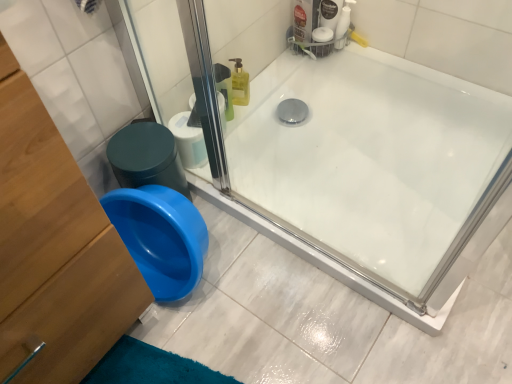
Question: From a real-world perspective, is white matte toilet paper at center physically above white glossy bathtub at center?

Choices:
 (A) no
 (B) yes

Answer: (B)

Question: Could you tell me if white matte toilet paper at center is facing white glossy bathtub at center?

Choices:
 (A) yes
 (B) no

Answer: (A)

Question: Considering the relative positions of white matte toilet paper at center and white glossy bathtub at center in the image provided, is white matte toilet paper at center to the right of white glossy bathtub at center from the viewer's perspective?

Choices:
 (A) no
 (B) yes

Answer: (A)

Question: Is white matte toilet paper at center oriented away from white glossy bathtub at center?

Choices:
 (A) no
 (B) yes

Answer: (A)

Question: From the image's perspective, does white matte toilet paper at center appear higher than white glossy bathtub at center?

Choices:
 (A) yes
 (B) no

Answer: (A)

Question: From the image's perspective, relative to wooden dresser at lower left, is white glossy bathtub at center above or below?

Choices:
 (A) above
 (B) below

Answer: (A)

Question: Relative to wooden dresser at lower left, is white glossy bathtub at center in front or behind?

Choices:
 (A) behind
 (B) front

Answer: (A)

Question: In the image, is white glossy bathtub at center on the left side or the right side of wooden dresser at lower left?

Choices:
 (A) right
 (B) left

Answer: (A)

Question: From their relative heights in the image, would you say white glossy bathtub at center is taller or shorter than wooden dresser at lower left?

Choices:
 (A) short
 (B) tall

Answer: (A)

Question: Which is correct: white matte toilet paper at center is inside white glossy bathtub at center, or outside of it?

Choices:
 (A) outside
 (B) inside

Answer: (A)

Question: From the image's perspective, is white matte toilet paper at center located above or below white glossy bathtub at center?

Choices:
 (A) above
 (B) below

Answer: (A)

Question: In the image, is white matte toilet paper at center on the left side or the right side of white glossy bathtub at center?

Choices:
 (A) right
 (B) left

Answer: (B)

Question: From a real-world perspective, is white matte toilet paper at center physically located above or below white glossy bathtub at center?

Choices:
 (A) below
 (B) above

Answer: (B)

Question: Looking at their shapes, would you say white glossy bathtub at center is wider or thinner than white matte toilet paper at center?

Choices:
 (A) wide
 (B) thin

Answer: (A)

Question: Relative to white matte toilet paper at center, is white glossy bathtub at center in front or behind?

Choices:
 (A) behind
 (B) front

Answer: (B)